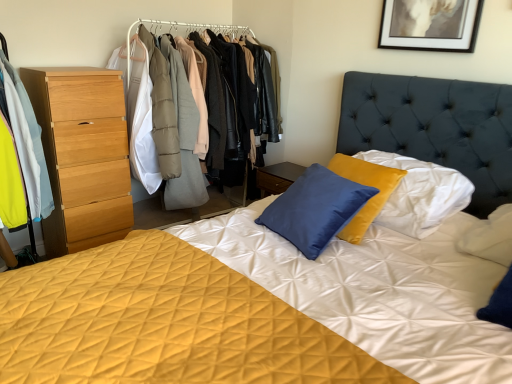
Question: Looking at the image, does wooden dresser at left seem bigger or smaller compared to light blue fabric coat at left?

Choices:
 (A) big
 (B) small

Answer: (A)

Question: From the image's perspective, is wooden dresser at left positioned above or below light blue fabric coat at left?

Choices:
 (A) above
 (B) below

Answer: (A)

Question: Which object is the closest to the light blue fabric coat at left?

Choices:
 (A) wooden dresser at left
 (B) light wood chest of drawers at left
 (C) black matte picture frame at upper center

Answer: (B)

Question: Considering the real-world distances, which object is farthest from the light wood chest of drawers at left?

Choices:
 (A) wooden dresser at left
 (B) black matte picture frame at upper center
 (C) light blue fabric coat at left

Answer: (B)